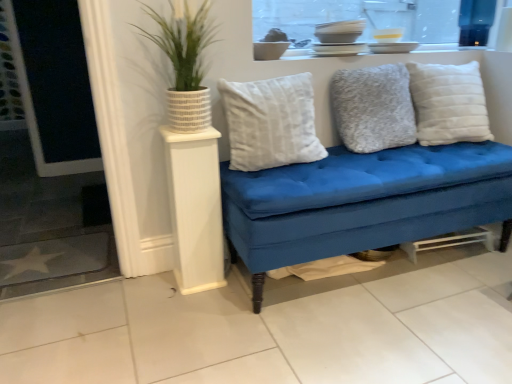
What do you see at coordinates (195, 209) in the screenshot? The height and width of the screenshot is (384, 512). I see `white wood side table at left` at bounding box center [195, 209].

Locate an element on the screen. This screenshot has height=384, width=512. fuzzy gray pillow at center, marked as the second pillow in a left-to-right arrangement is located at coordinates (373, 108).

Where is `green textured plant at upper left`? This screenshot has width=512, height=384. green textured plant at upper left is located at coordinates (183, 42).

You are a GUI agent. You are given a task and a screenshot of the screen. Output one action in this format:
    pyautogui.click(x=<x>, y=<y>)
    Task: Click on the white wood side table at left
    
    Given the screenshot: What is the action you would take?
    pyautogui.click(x=195, y=209)

Can you confirm if green textured plant at upper left is thinner than white plush pillow at center, the first pillow in the left-to-right sequence?

No.

How many degrees apart are the facing directions of green textured plant at upper left and white plush pillow at center, the first pillow in the left-to-right sequence?

The angular difference between green textured plant at upper left and white plush pillow at center, the first pillow in the left-to-right sequence, is 5.5 degrees.

Is green textured plant at upper left facing towards white plush pillow at center, placed as the 3th pillow when sorted from right to left?

No, green textured plant at upper left is not turned towards white plush pillow at center, placed as the 3th pillow when sorted from right to left.

From their relative heights in the image, would you say green textured plant at upper left is taller or shorter than white plush pillow at center, the first pillow in the left-to-right sequence?

In the image, green textured plant at upper left appears to be taller than white plush pillow at center, the first pillow in the left-to-right sequence.

From a real-world perspective, is white wood side table at left positioned above or below white textured pillow at right, the 1th pillow in the right-to-left sequence?

In terms of real-world spatial position, white wood side table at left is below white textured pillow at right, the 1th pillow in the right-to-left sequence.

Looking at this image, is white wood side table at left aimed at white textured pillow at right, the 1th pillow in the right-to-left sequence?

No.

Considering the sizes of white wood side table at left and white textured pillow at right, the 1th pillow in the right-to-left sequence, in the image, is white wood side table at left wider or thinner than white textured pillow at right, the 1th pillow in the right-to-left sequence,?

Considering their sizes, white wood side table at left looks slimmer than white textured pillow at right, the 1th pillow in the right-to-left sequence.

How much distance is there between white wood side table at left and white textured pillow at right, the 1th pillow in the right-to-left sequence?

A distance of 1.07 meters exists between white wood side table at left and white textured pillow at right, the 1th pillow in the right-to-left sequence.

Does point (275, 162) come in front of point (466, 75)?

Yes, point (275, 162) is closer to viewer.

Consider the image. Is white plush pillow at center, the first pillow in the left-to-right sequence, far away from white textured pillow at right, the 1th pillow in the right-to-left sequence?

white plush pillow at center, the first pillow in the left-to-right sequence, is actually quite close to white textured pillow at right, the 1th pillow in the right-to-left sequence.

From the image's perspective, which object appears higher, white plush pillow at center, placed as the 3th pillow when sorted from right to left, or white textured pillow at right, which is the third pillow in left-to-right order?

white textured pillow at right, which is the third pillow in left-to-right order, appears higher in the image.

Who is bigger, white plush pillow at center, the first pillow in the left-to-right sequence, or white textured pillow at right, the 1th pillow in the right-to-left sequence?

With larger size is white textured pillow at right, the 1th pillow in the right-to-left sequence.

From the image's perspective, is fuzzy gray pillow at center, marked as the second pillow in a left-to-right arrangement, located above or below white textured pillow at right, the 1th pillow in the right-to-left sequence?

Based on their image positions, fuzzy gray pillow at center, marked as the second pillow in a left-to-right arrangement, is located beneath white textured pillow at right, the 1th pillow in the right-to-left sequence.

Which point is more forward, (345, 85) or (469, 117)?

The point (345, 85) is more forward.

Which is correct: fuzzy gray pillow at center, which is the second pillow from right to left, is inside white textured pillow at right, which is the third pillow in left-to-right order, or outside of it?

The correct answer is: outside.

From the white textured pillow at right, the 1th pillow in the right-to-left sequence, count the 1st pillow to the left and point to it. Please provide its 2D coordinates.

[(373, 108)]

Is white wood side table at left taller or shorter than white plush pillow at center, placed as the 3th pillow when sorted from right to left?

In the image, white wood side table at left appears to be taller than white plush pillow at center, placed as the 3th pillow when sorted from right to left.

Are white wood side table at left and white plush pillow at center, placed as the 3th pillow when sorted from right to left, located far from each other?

That's not correct — white wood side table at left is a little close to white plush pillow at center, placed as the 3th pillow when sorted from right to left.

From the image's perspective, who appears lower, white wood side table at left or white plush pillow at center, placed as the 3th pillow when sorted from right to left?

white wood side table at left is shown below in the image.

Find the location of a particular element. The image size is (512, 384). side table that appears below the white plush pillow at center, the first pillow in the left-to-right sequence (from the image's perspective) is located at coordinates (195, 209).

Considering the relative sizes of fuzzy gray pillow at center, which is the second pillow from right to left, and green textured plant at upper left in the image provided, is fuzzy gray pillow at center, which is the second pillow from right to left, taller than green textured plant at upper left?

Incorrect, the height of fuzzy gray pillow at center, which is the second pillow from right to left, is not larger of that of green textured plant at upper left.

Which is in front, fuzzy gray pillow at center, which is the second pillow from right to left, or green textured plant at upper left?

Positioned in front is green textured plant at upper left.

Is fuzzy gray pillow at center, which is the second pillow from right to left, oriented towards green textured plant at upper left?

No, fuzzy gray pillow at center, which is the second pillow from right to left, is not facing towards green textured plant at upper left.

Is fuzzy gray pillow at center, which is the second pillow from right to left, to the left of white wood side table at left from the viewer's perspective?

Incorrect, fuzzy gray pillow at center, which is the second pillow from right to left, is not on the left side of white wood side table at left.

In the scene shown: Is fuzzy gray pillow at center, which is the second pillow from right to left, far away from white wood side table at left?

They are positioned close to each other.

The image size is (512, 384). In order to click on the 2nd pillow to the right when counting from the white wood side table at left in this screenshot , I will do `click(373, 108)`.

Consider the image. Is white wood side table at left a part of fuzzy gray pillow at center, which is the second pillow from right to left?

No, white wood side table at left is not inside fuzzy gray pillow at center, which is the second pillow from right to left.

At what (x,y) coordinates should I click in order to perform the action: click on pillow that is the 3rd object located below the green textured plant at upper left (from the image's perspective). Please return your answer as a coordinate pair (x, y). Looking at the image, I should click on (271, 122).

Locate an element on the screen. Image resolution: width=512 pixels, height=384 pixels. the 3rd pillow to the right of the white wood side table at left, counting from the anchor's position is located at coordinates (449, 103).

From the image, which object appears to be nearer to white textured pillow at right, which is the third pillow in left-to-right order, green textured plant at upper left or white plush pillow at center, the first pillow in the left-to-right sequence?

white plush pillow at center, the first pillow in the left-to-right sequence, lies closer to white textured pillow at right, which is the third pillow in left-to-right order, than the other object.

When comparing their distances from white wood side table at left, does white textured pillow at right, which is the third pillow in left-to-right order, or green textured plant at upper left seem further?

white textured pillow at right, which is the third pillow in left-to-right order, is positioned further to the anchor white wood side table at left.

Estimate the real-world distances between objects in this image. Which object is closer to fuzzy gray pillow at center, which is the second pillow from right to left, green textured plant at upper left or white wood side table at left?

Among the two, green textured plant at upper left is located nearer to fuzzy gray pillow at center, which is the second pillow from right to left.

Based on their spatial positions, is green textured plant at upper left or white wood side table at left further from white textured pillow at right, the 1th pillow in the right-to-left sequence?

white wood side table at left lies further to white textured pillow at right, the 1th pillow in the right-to-left sequence, than the other object.

Estimate the real-world distances between objects in this image. Which object is further from white plush pillow at center, placed as the 3th pillow when sorted from right to left, white textured pillow at right, which is the third pillow in left-to-right order, or green textured plant at upper left?

white textured pillow at right, which is the third pillow in left-to-right order, is positioned further to the anchor white plush pillow at center, placed as the 3th pillow when sorted from right to left.

Estimate the real-world distances between objects in this image. Which object is closer to fuzzy gray pillow at center, which is the second pillow from right to left, white textured pillow at right, which is the third pillow in left-to-right order, or white plush pillow at center, placed as the 3th pillow when sorted from right to left?

Among the two, white textured pillow at right, which is the third pillow in left-to-right order, is located nearer to fuzzy gray pillow at center, which is the second pillow from right to left.

Estimate the real-world distances between objects in this image. Which object is closer to white textured pillow at right, which is the third pillow in left-to-right order, fuzzy gray pillow at center, which is the second pillow from right to left, or green textured plant at upper left?

fuzzy gray pillow at center, which is the second pillow from right to left, is closer to white textured pillow at right, which is the third pillow in left-to-right order.

Estimate the real-world distances between objects in this image. Which object is closer to white wood side table at left, green textured plant at upper left or white plush pillow at center, placed as the 3th pillow when sorted from right to left?

The object closer to white wood side table at left is white plush pillow at center, placed as the 3th pillow when sorted from right to left.

This screenshot has height=384, width=512. Identify the location of pillow situated between green textured plant at upper left and fuzzy gray pillow at center, marked as the second pillow in a left-to-right arrangement, from left to right. (271, 122).

At what (x,y) coordinates should I click in order to perform the action: click on pillow between white wood side table at left and fuzzy gray pillow at center, which is the second pillow from right to left, in the horizontal direction. Please return your answer as a coordinate pair (x, y). This screenshot has height=384, width=512. Looking at the image, I should click on (271, 122).

Locate an element on the screen. side table between green textured plant at upper left and white textured pillow at right, which is the third pillow in left-to-right order, in the horizontal direction is located at coordinates (195, 209).

This screenshot has height=384, width=512. Identify the location of side table located between green textured plant at upper left and fuzzy gray pillow at center, marked as the second pillow in a left-to-right arrangement, in the left-right direction. (195, 209).